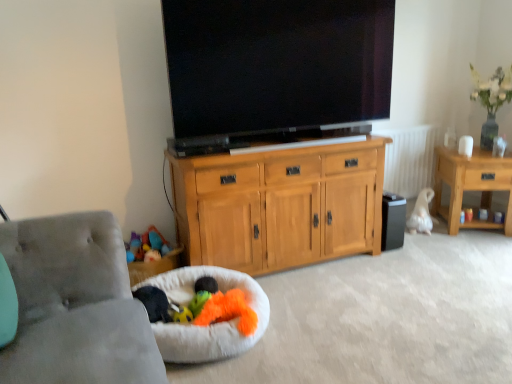
Find the location of a particular element. vacant space underneath black plastic speaker at lower right (from a real-world perspective) is located at coordinates (388, 246).